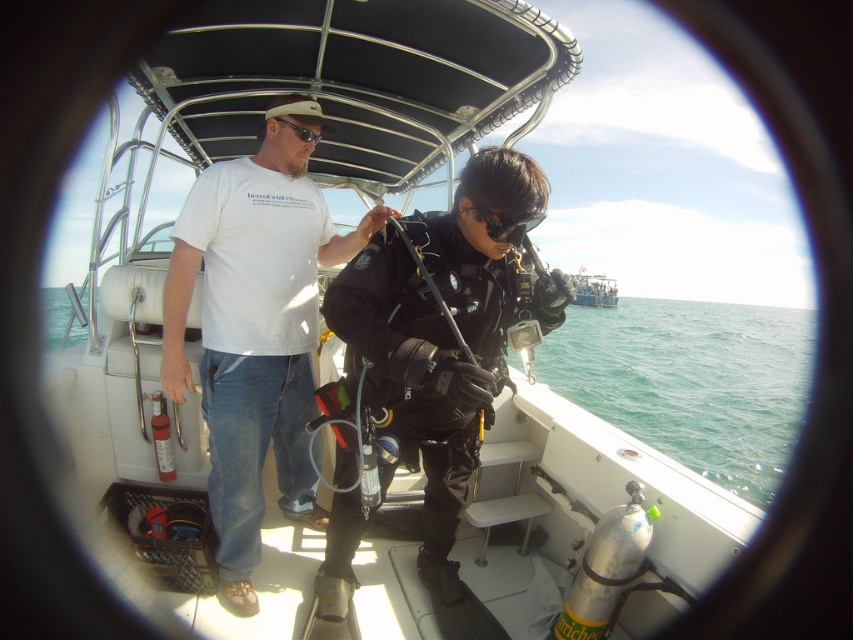
Question: Is black matte goggles at center below matte black goggles at upper center?

Choices:
 (A) yes
 (B) no

Answer: (A)

Question: Which is farther from the white cotton t-shirt at upper center?

Choices:
 (A) black matte diving suit at center
 (B) black rubber wetsuit at center
 (C) black matte goggles at center
 (D) matte black goggles at upper center

Answer: (B)

Question: Which point appears farthest from the camera in this image?

Choices:
 (A) (595, 276)
 (B) (456, 602)
 (C) (311, 269)
 (D) (496, 232)

Answer: (A)

Question: Observing the image, what is the correct spatial positioning of black matte diving suit at center in reference to black matte goggles at center?

Choices:
 (A) below
 (B) above

Answer: (A)

Question: Does white cotton t-shirt at upper center have a greater width compared to black rubber wetsuit at center?

Choices:
 (A) no
 (B) yes

Answer: (A)

Question: Which point is farther from the camera taking this photo?

Choices:
 (A) [212, 486]
 (B) [357, 276]

Answer: (A)